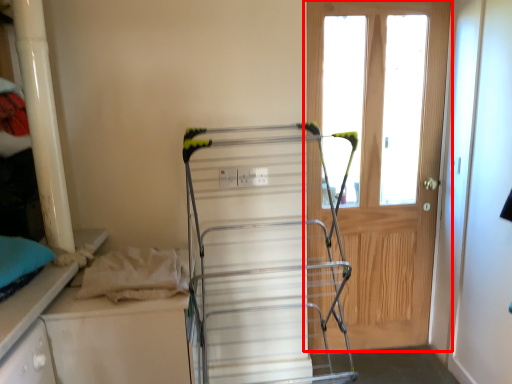
Question: From the image's perspective, what is the correct spatial positioning of door (annotated by the red box) in reference to wide?

Choices:
 (A) above
 (B) below

Answer: (A)